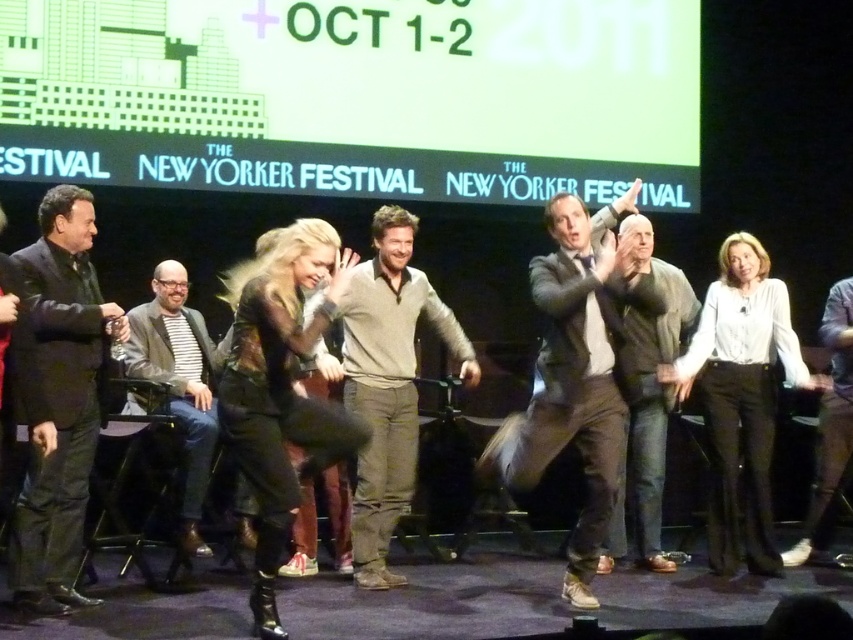
Question: Which point appears closest to the camera in this image?

Choices:
 (A) (376, 452)
 (B) (744, 417)
 (C) (183, 387)
 (D) (643, 435)

Answer: (A)

Question: Does leather jacket at center appear on the left side of light brown sweater at center?

Choices:
 (A) no
 (B) yes

Answer: (B)

Question: Which of the following is the farthest from the observer?

Choices:
 (A) click(x=636, y=524)
 (B) click(x=56, y=209)
 (C) click(x=579, y=538)

Answer: (A)

Question: Does black suit at left have a smaller size compared to white shirt at right?

Choices:
 (A) no
 (B) yes

Answer: (A)

Question: Can you confirm if leather jacket at center is thinner than dark gray sweater at center?

Choices:
 (A) no
 (B) yes

Answer: (B)

Question: Which object is the farthest from the striped fabric shirt at center?

Choices:
 (A) brown leather jacket at center
 (B) white shirt at right

Answer: (B)